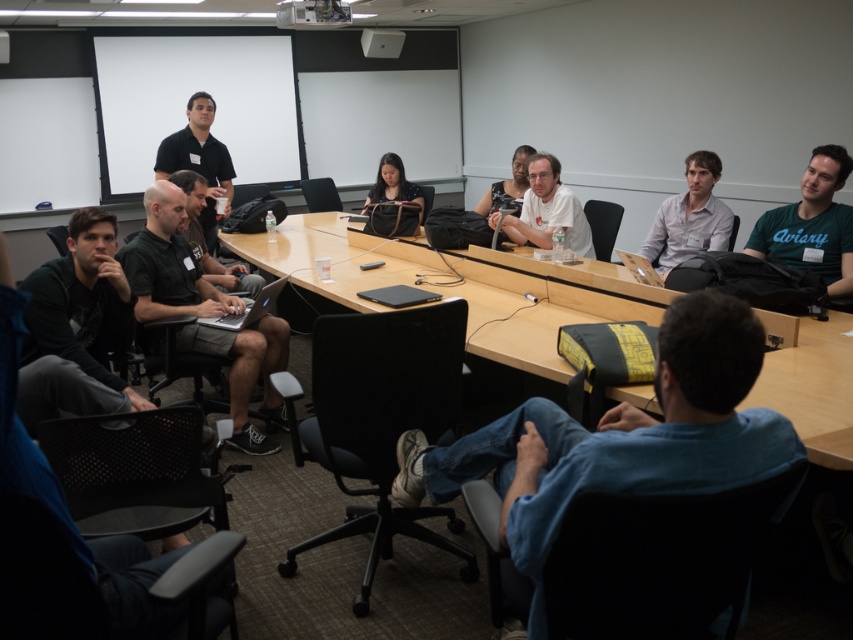
You are an office assistant who needs to place a new plant pot that is 1 meter tall on the desk between the denim jeans at lower right and the white plastic projector at upper center. Which object should the plant pot be placed closer to so it doesn t block the projector s view?

The denim jeans at lower right is taller than the white plastic projector at upper center. To avoid blocking the projector s view, the plant pot should be placed closer to the denim jeans at lower right.

You are an event organizer who needs to set up a presentation. You have a white plastic projector at upper center and denim jeans at lower right in the room. Which object is wider?

The denim jeans at lower right is wider than the white plastic projector at upper center according to the description.

You are a photographer standing at the back of the room near the unused screen. You want to take a photo of the white matte shirt at center and the matte brown bag at center without any obstruction. Since you can adjust your camera angle, which object should you aim to focus on first to ensure both are visible?

The white matte shirt at center has a greater height compared to the matte brown bag at center. Therefore, you should focus on the white matte shirt at center first, as it is taller and will be more visible in the frame. Adjusting the camera angle to capture its height will naturally include the shorter matte brown bag at center in the photo.